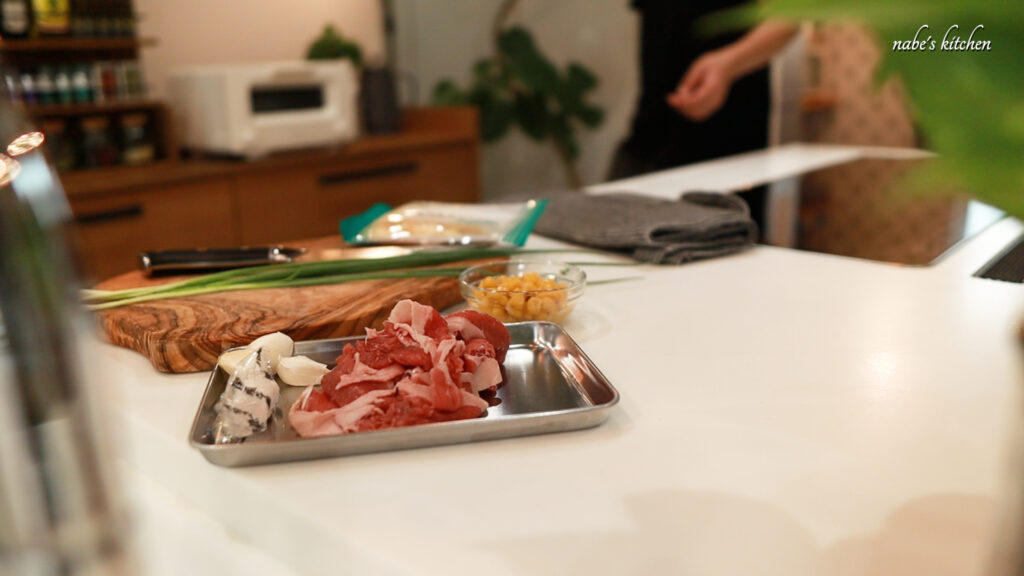
Show me where wood rack? with spices? are located in the image. Your answer should be formatted as a list of tuples, i.e. [(x1, y1), (x2, y2), ...], where each tuple contains the x and y coordinates of a point satisfying the conditions above.

[(52, 15)]